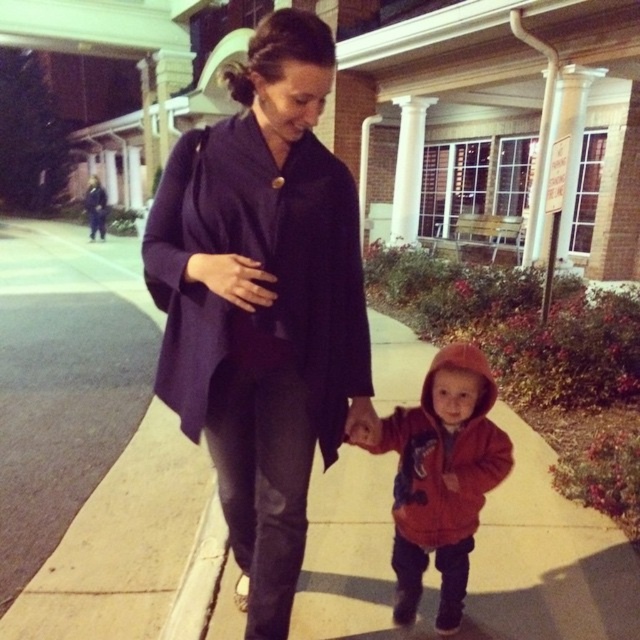
You are a pedestrian standing on the sidewalk in front of the building. You see the dark purple woolen coat at center and the concrete at lower left. Which object is closer to you?

The dark purple woolen coat at center is closer to you because it is positioned over the concrete at lower left, indicating it is in front of it.

You are standing on the sidewalk and see the dark purple woolen coat at center and the concrete at lower left. Which object is closer to your left side?

The concrete at lower left is closer to your left side because it is positioned to the left of the dark purple woolen coat at center.

You are standing on the sidewalk in front of the building and see the dark purple woolen coat at center. If you want to reach into your pocket to retrieve your keys, will you be able to do so without moving closer to the coat?

The dark purple woolen coat at center is 1.48 meters away from the viewer, so you can easily reach into your pocket without moving closer to the coat since the distance is sufficient for normal arm movement.